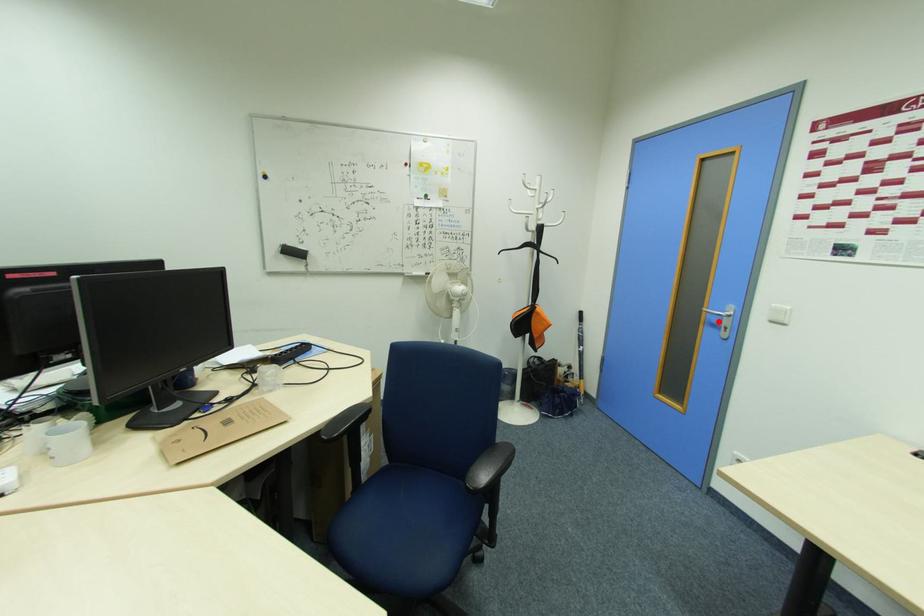
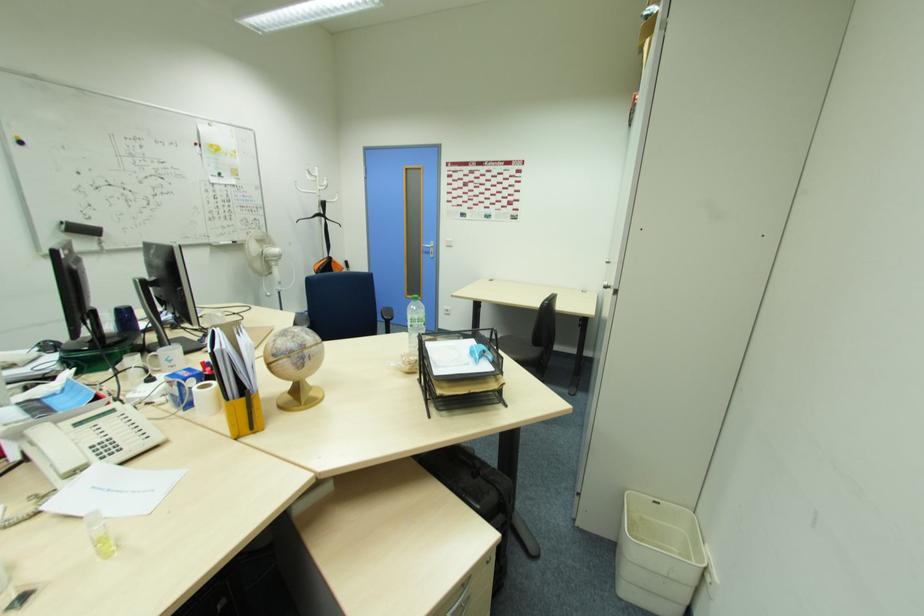
The point at the highlighted location is marked in the first image. Where is the corresponding point in the second image?

(430, 252)